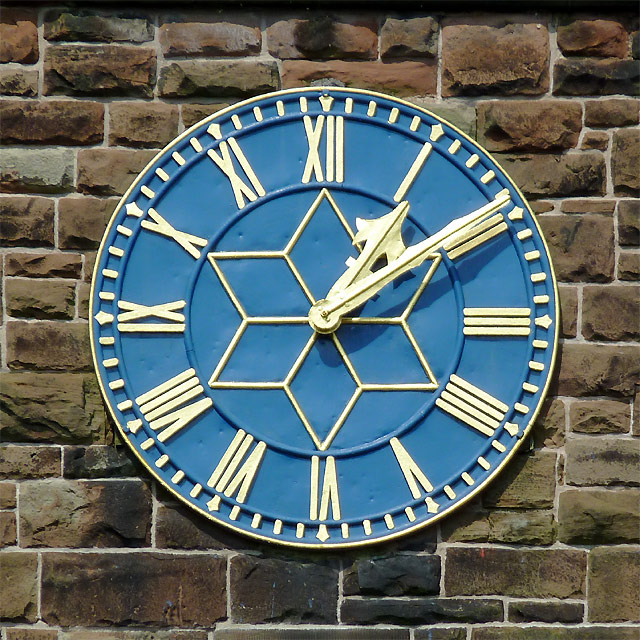
I want to click on wall, so click(83, 444).